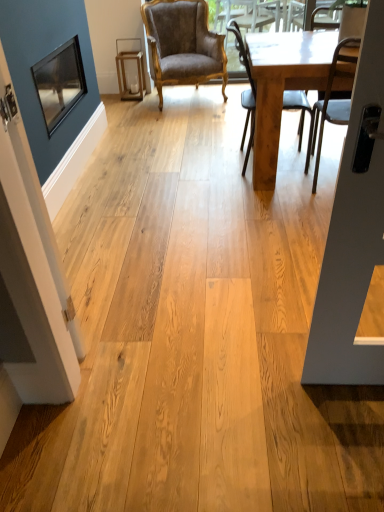
This screenshot has height=512, width=384. What are the coordinates of `free space between light brown wooden chair at center, which is the 2th chair in left-to-right order, and matte black screen door at left` in the screenshot? It's located at (197, 232).